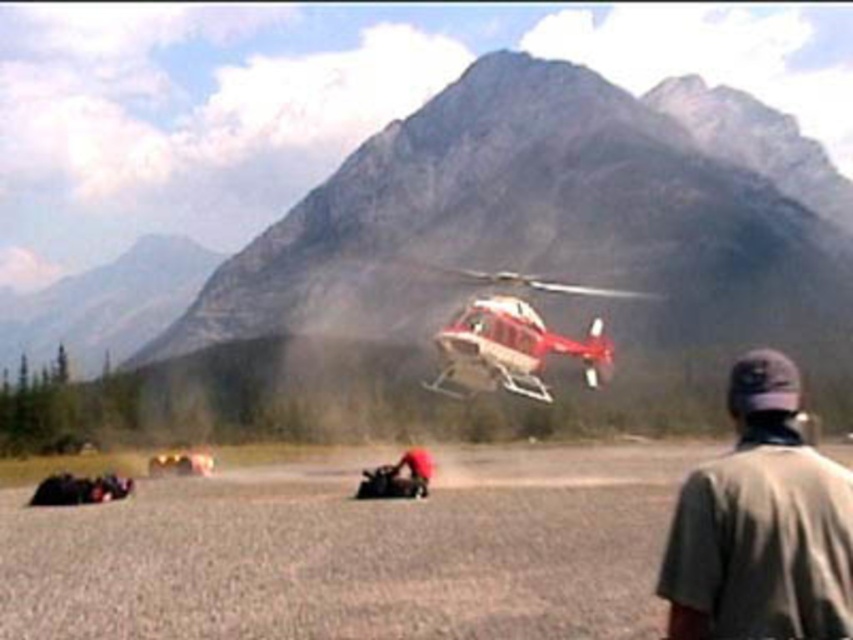
You are a pilot flying a helicopter. You need to land on the gravelly area near the red fabric bag at center. Based on the scene, will the rugged stone mountain at upper center block your view of the landing area?

The rugged stone mountain at upper center is located above the red fabric bag at center, so it may block your view of the landing area near the red fabric bag at center during your approach.

You are a pilot flying a red matte helicopter at center. You need to land it on a specific point marked as point (511, 348). Can you confirm if the helicopter is currently positioned above that point?

Yes, the point (511, 348) corresponds to the red matte helicopter at center, meaning the helicopter is indeed positioned above that point.

You are a drone operator trying to capture a photo of the point at coordinates (834, 307) in the scene. The drone can only focus on objects within 150 meters. Will the drone be able to focus on the point?

The point at coordinates (834, 307) is 147.79 meters from the camera, which is within the drone operator s 150 meter focus range. The drone will be able to focus on the point.